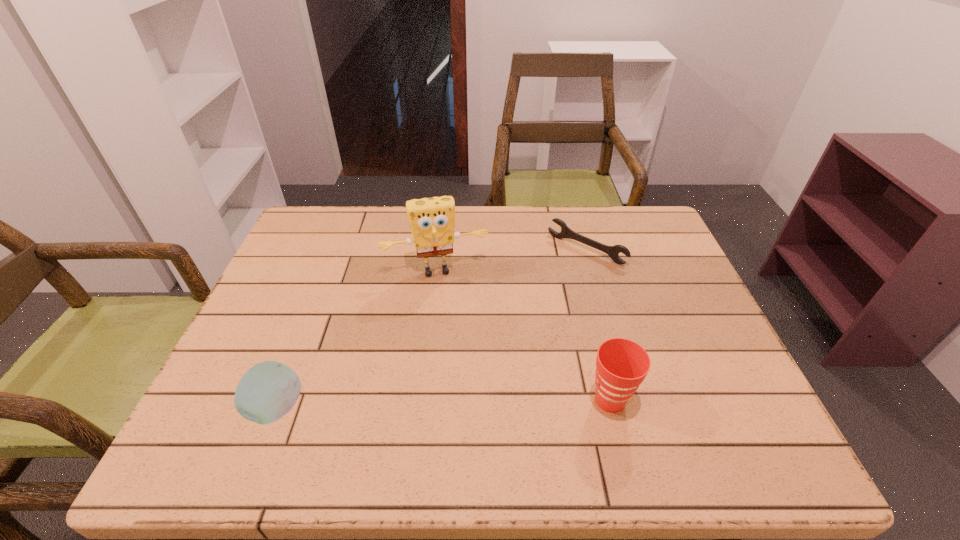
Locate an element on the screen. vacant position located on the face of the tallest object is located at coordinates (464, 362).

Find the location of a particular element. This screenshot has height=540, width=960. vacant space located on the open ends of the wrench is located at coordinates (508, 325).

The width and height of the screenshot is (960, 540). Find the location of `vacant region located 0.320m on the open ends of the wrench`. vacant region located 0.320m on the open ends of the wrench is located at coordinates (500, 332).

At what (x,y) coordinates should I click in order to perform the action: click on free region located on the open ends of the wrench. Please return your answer as a coordinate pair (x, y). This screenshot has height=540, width=960. Looking at the image, I should click on (554, 277).

This screenshot has width=960, height=540. Find the location of `object positioned at the far edge`. object positioned at the far edge is located at coordinates (613, 251).

Find the location of `apple present at the near edge`. apple present at the near edge is located at coordinates 267,391.

Locate an element on the screen. cup situated at the near edge is located at coordinates (621, 366).

Identify the location of object that is at the left edge. (267, 391).

You are a GUI agent. You are given a task and a screenshot of the screen. Output one action in this format:
    pyautogui.click(x=<x>, y=<y>)
    Task: Click on the object that is at the right edge
    This screenshot has height=540, width=960.
    Given the screenshot: What is the action you would take?
    pyautogui.click(x=613, y=251)

What are the coordinates of `object that is at the near left corner` in the screenshot? It's located at pyautogui.click(x=267, y=391).